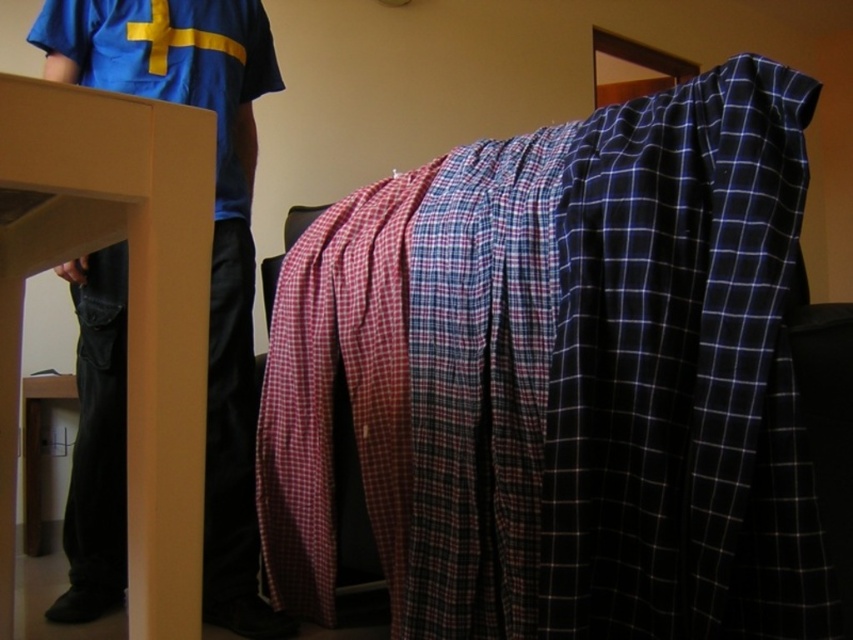
Question: Which object is farther from the camera taking this photo?

Choices:
 (A) blue cotton shirt at upper left
 (B) blue matte shirt at upper left

Answer: (B)

Question: Does plaid fabric blanket at center lie behind blue matte shirt at upper left?

Choices:
 (A) no
 (B) yes

Answer: (A)

Question: Can you confirm if plaid fabric blanket at center is positioned to the left of blue cotton shirt at upper left?

Choices:
 (A) no
 (B) yes

Answer: (A)

Question: In this image, where is blue cotton shirt at upper left located relative to blue matte shirt at upper left?

Choices:
 (A) above
 (B) below

Answer: (B)

Question: Which of the following is the closest to the observer?

Choices:
 (A) plaid fabric blanket at center
 (B) blue cotton shirt at upper left

Answer: (A)

Question: Which point is farther to the camera?

Choices:
 (A) plaid fabric blanket at center
 (B) blue matte shirt at upper left
 (C) blue cotton shirt at upper left

Answer: (B)